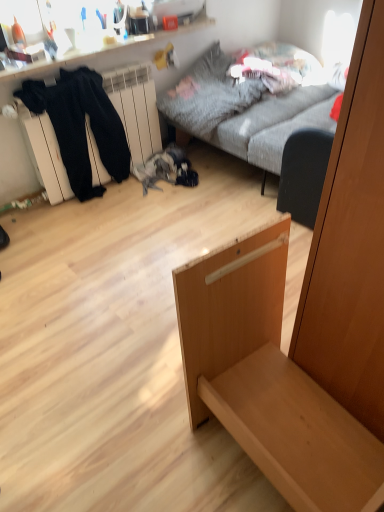
Question: Should I look upward or downward to see black cotton pants at left?

Choices:
 (A) up
 (B) down

Answer: (A)

Question: Is light wood drawer at center positioned with its back to black fabric armchair at center?

Choices:
 (A) yes
 (B) no

Answer: (B)

Question: From the image's perspective, is light wood drawer at center over black fabric armchair at center?

Choices:
 (A) yes
 (B) no

Answer: (B)

Question: Is the position of light wood drawer at center more distant than that of black fabric armchair at center?

Choices:
 (A) yes
 (B) no

Answer: (B)

Question: From a real-world perspective, is light wood drawer at center below black fabric armchair at center?

Choices:
 (A) no
 (B) yes

Answer: (A)

Question: From the image's perspective, would you say light wood drawer at center is shown under black fabric armchair at center?

Choices:
 (A) no
 (B) yes

Answer: (B)

Question: Is light wood drawer at center facing towards black fabric armchair at center?

Choices:
 (A) no
 (B) yes

Answer: (A)

Question: Considering the relative sizes of black fabric armchair at center and black cotton pants at left in the image provided, is black fabric armchair at center bigger than black cotton pants at left?

Choices:
 (A) no
 (B) yes

Answer: (A)

Question: Is black fabric armchair at center in front of black cotton pants at left?

Choices:
 (A) yes
 (B) no

Answer: (A)

Question: From the image's perspective, is black fabric armchair at center over black cotton pants at left?

Choices:
 (A) yes
 (B) no

Answer: (B)

Question: Is black fabric armchair at center thinner than black cotton pants at left?

Choices:
 (A) yes
 (B) no

Answer: (A)

Question: Does black fabric armchair at center have a greater height compared to black cotton pants at left?

Choices:
 (A) no
 (B) yes

Answer: (A)

Question: Is black fabric armchair at center surrounding black cotton pants at left?

Choices:
 (A) yes
 (B) no

Answer: (B)

Question: Can you confirm if gray fabric couch at upper center is bigger than black fabric armchair at center?

Choices:
 (A) yes
 (B) no

Answer: (A)